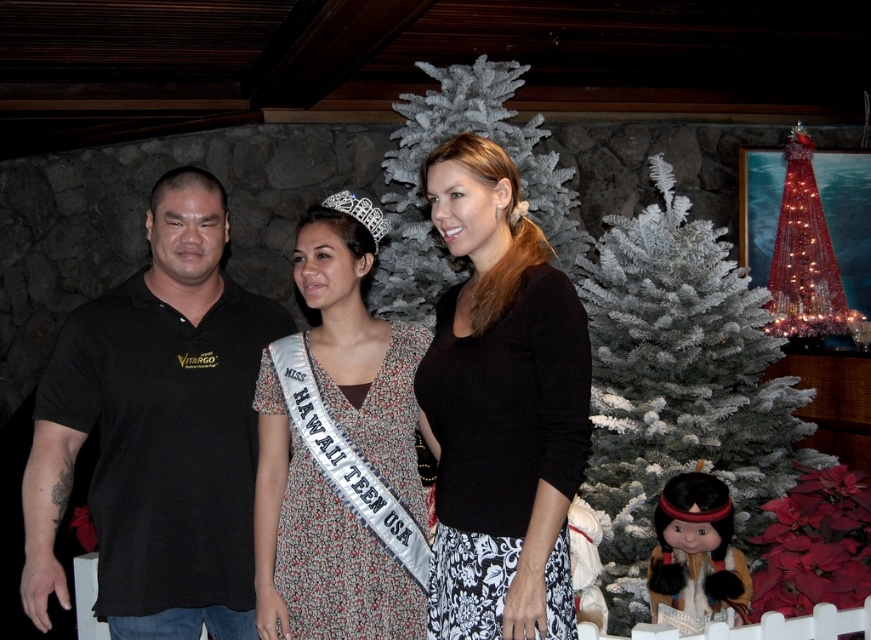
You are standing in the center of the room and want to take a photo of the white frosted christmas tree at right. Based on its coordinates, in which direction should you move to frame it properly?

You should move to your right since the white frosted christmas tree at right is located at coordinates point [679,384], which is to the right side of the image.